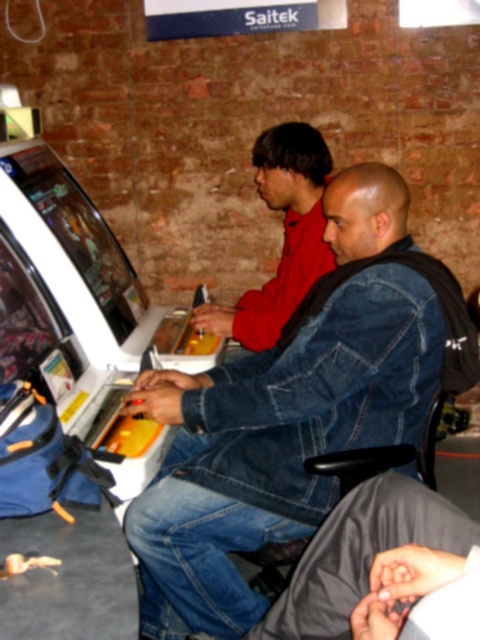
You are trying to decide which person is closer to the control panel of the arcade machine. The denim jacket at center and the red matte shirt at center are both facing the screen. Based on their positions, which one is closer to the control panel?

The denim jacket at center is positioned on the left side of red matte shirt at center, so the denim jacket at center is closer to the control panel since it is on the left side.

You are a person who is 1.7 meters tall and want to play the arcade game. The control panel is at point (334, 220). Can you comfortably reach the control panel?

The distance between you and the control panel at point (334, 220) is 1.73 meters. Since you are 1.7 meters tall, you may not be able to comfortably reach the control panel as the distance is slightly longer than your height.